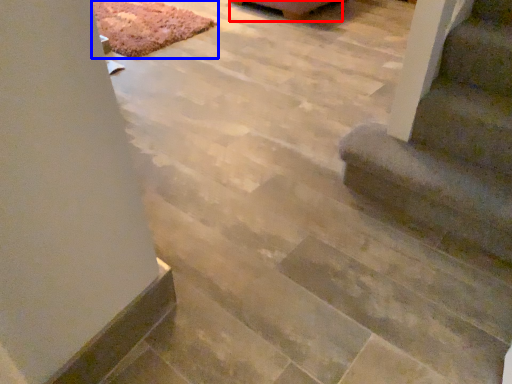
Question: Which object is further to the camera taking this photo, furniture (highlighted by a red box) or mat (highlighted by a blue box)?

Choices:
 (A) furniture
 (B) mat

Answer: (A)